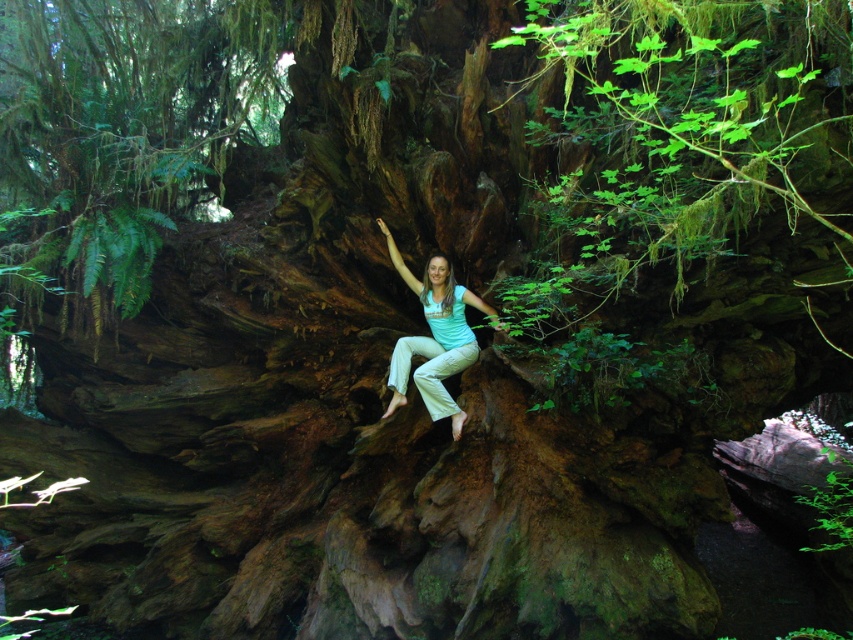
You are a hiker who wants to take a photo of the light blue cotton shirt at center and the green mossy tree trunk at center. Which object should you focus on first if you want to capture both in a single frame without moving the camera?

The green mossy tree trunk at center is larger in size than the light blue cotton shirt at center, so you should focus on the green mossy tree trunk at center first to ensure it fits properly in the frame before adjusting for the smaller light blue cotton shirt at center.

You are standing at the edge of the forest and see the green mossy tree trunk at center. Based on its position, can you estimate whether it is closer to the front or the back of the scene?

The green mossy tree trunk at center is located at point coordinates that suggest it is positioned closer to the front of the scene compared to the back.